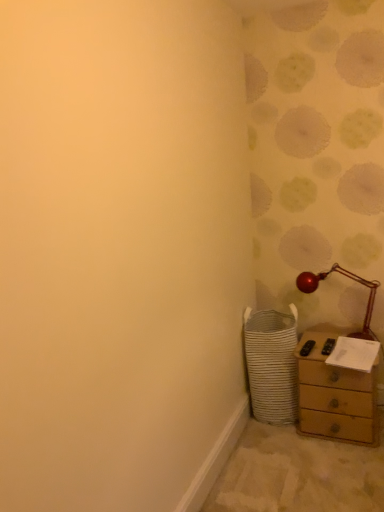
You are a GUI agent. You are given a task and a screenshot of the screen. Output one action in this format:
    pyautogui.click(x=<x>, y=<y>)
    Task: Click on the wooden chest of drawers at lower right
    The height and width of the screenshot is (512, 384).
    Given the screenshot: What is the action you would take?
    pyautogui.click(x=335, y=395)

Considering the relative positions of metallic red table lamp at right and wooden chest of drawers at lower right in the image provided, is metallic red table lamp at right to the right of wooden chest of drawers at lower right from the viewer's perspective?

In fact, metallic red table lamp at right is to the left of wooden chest of drawers at lower right.

Is point (344, 270) closer or farther from the camera than point (349, 369)?

Point (344, 270) appears to be farther away from the viewer than point (349, 369).

Is metallic red table lamp at right not inside wooden chest of drawers at lower right?

Yes.

Looking at the image, does metallic red table lamp at right seem bigger or smaller compared to wooden chest of drawers at lower right?

Considering their sizes, metallic red table lamp at right takes up less space than wooden chest of drawers at lower right.

This screenshot has height=512, width=384. I want to click on table lamp above the wooden chest of drawers at lower right (from a real-world perspective), so click(x=351, y=279).

Choose the correct answer: Is wooden chest of drawers at lower right inside metallic red table lamp at right or outside it?

wooden chest of drawers at lower right is not enclosed by metallic red table lamp at right.

From the image's perspective, would you say metallic red table lamp at right is shown under white woven laundry basket at lower right?

Incorrect, from the image's perspective, metallic red table lamp at right is higher than white woven laundry basket at lower right.

Measure the distance from metallic red table lamp at right to white woven laundry basket at lower right.

The distance of metallic red table lamp at right from white woven laundry basket at lower right is 17.21 inches.

Is metallic red table lamp at right completely or partially outside of white woven laundry basket at lower right?

Yes.

Is metallic red table lamp at right shorter than white woven laundry basket at lower right?

Indeed, metallic red table lamp at right has a lesser height compared to white woven laundry basket at lower right.

Between white woven laundry basket at lower right and wooden chest of drawers at lower right, which one appears on the left side from the viewer's perspective?

white woven laundry basket at lower right is more to the left.

Is white woven laundry basket at lower right touching wooden chest of drawers at lower right?

No, white woven laundry basket at lower right is not touching wooden chest of drawers at lower right.

From a real-world perspective, relative to wooden chest of drawers at lower right, is white woven laundry basket at lower right vertically above or below?

From a real-world perspective, white woven laundry basket at lower right is physically above wooden chest of drawers at lower right.

Looking at their sizes, would you say white woven laundry basket at lower right is wider or thinner than wooden chest of drawers at lower right?

Clearly, white woven laundry basket at lower right has more width compared to wooden chest of drawers at lower right.

Can you confirm if white woven laundry basket at lower right is bigger than metallic red table lamp at right?

Correct, white woven laundry basket at lower right is larger in size than metallic red table lamp at right.

Could you tell me if white woven laundry basket at lower right is facing metallic red table lamp at right?

No, white woven laundry basket at lower right is not turned towards metallic red table lamp at right.

From the image's perspective, is white woven laundry basket at lower right under metallic red table lamp at right?

Yes, from the image's perspective, white woven laundry basket at lower right is below metallic red table lamp at right.

Which of these two, white woven laundry basket at lower right or metallic red table lamp at right, is wider?

white woven laundry basket at lower right is wider.

Between wooden chest of drawers at lower right and white woven laundry basket at lower right, which one has more height?

white woven laundry basket at lower right is taller.

Considering the points (317, 341) and (251, 409), which point is in front, point (317, 341) or point (251, 409)?

Point (317, 341)

Considering the relative positions of wooden chest of drawers at lower right and white woven laundry basket at lower right in the image provided, is wooden chest of drawers at lower right to the right of white woven laundry basket at lower right from the viewer's perspective?

Yes, wooden chest of drawers at lower right is to the right of white woven laundry basket at lower right.

The image size is (384, 512). In order to click on table lamp located behind the wooden chest of drawers at lower right in this screenshot , I will do `click(351, 279)`.

The width and height of the screenshot is (384, 512). Find the location of `table lamp to the left of wooden chest of drawers at lower right`. table lamp to the left of wooden chest of drawers at lower right is located at coordinates (351, 279).

When comparing their distances from metallic red table lamp at right, does white woven laundry basket at lower right or wooden chest of drawers at lower right seem closer?

wooden chest of drawers at lower right is closer to metallic red table lamp at right.

Consider the image. Which object lies further to the anchor point white woven laundry basket at lower right, metallic red table lamp at right or wooden chest of drawers at lower right?

metallic red table lamp at right is further to white woven laundry basket at lower right.

Looking at the image, which one is located closer to wooden chest of drawers at lower right, white woven laundry basket at lower right or metallic red table lamp at right?

The object closer to wooden chest of drawers at lower right is white woven laundry basket at lower right.

Which object lies further to the anchor point metallic red table lamp at right, wooden chest of drawers at lower right or white woven laundry basket at lower right?

white woven laundry basket at lower right.

Considering their positions, is metallic red table lamp at right positioned closer to wooden chest of drawers at lower right than white woven laundry basket at lower right?

white woven laundry basket at lower right is closer to wooden chest of drawers at lower right.

Looking at the image, which one is located closer to white woven laundry basket at lower right, wooden chest of drawers at lower right or metallic red table lamp at right?

The object closer to white woven laundry basket at lower right is wooden chest of drawers at lower right.

This screenshot has height=512, width=384. Find the location of `laundry basket between metallic red table lamp at right and wooden chest of drawers at lower right in the vertical direction`. laundry basket between metallic red table lamp at right and wooden chest of drawers at lower right in the vertical direction is located at coordinates (271, 364).